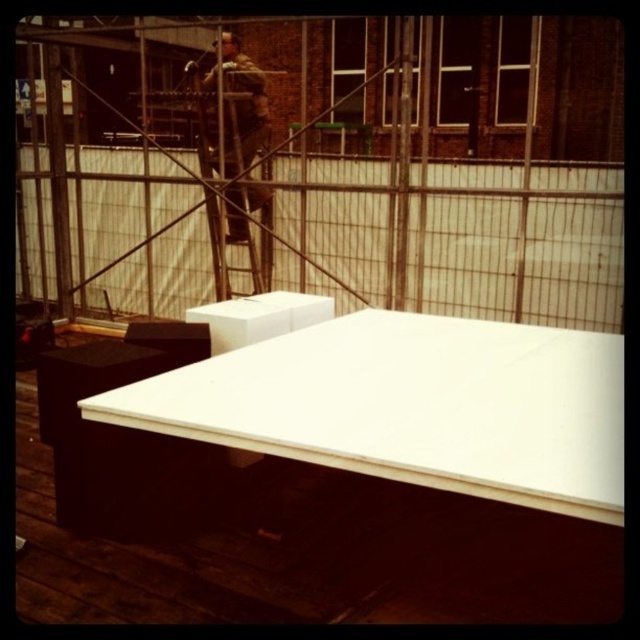
You are an inspector checking the construction site. You need to access the white matte table at center to review documents. Is the metallic silver ladder at upper center positioned in a way that allows you to reach the table?

The white matte table at center is below the metallic silver ladder at upper center, so the ladder is positioned above the table. To reach the table, you would need to descend from the ladder or use it as a support while standing on the ground.

You are an interior designer who needs to place a new sculpture on the white matte table at center or the metallic silver ladder at upper center. Considering their sizes, which object can accommodate a larger sculpture?

The white matte table at center has a larger size compared to the metallic silver ladder at upper center, so it can accommodate a larger sculpture.

You are a delivery person holding a package that requires a table to place it on. You see the white matte table at center. Can you place the package on it without moving closer than 2 meters from your current position?

The white matte table at center is 1.95 meters away from the viewer, so yes, you can place the package on it without moving closer than 2 meters since the distance is slightly less than 2 meters.